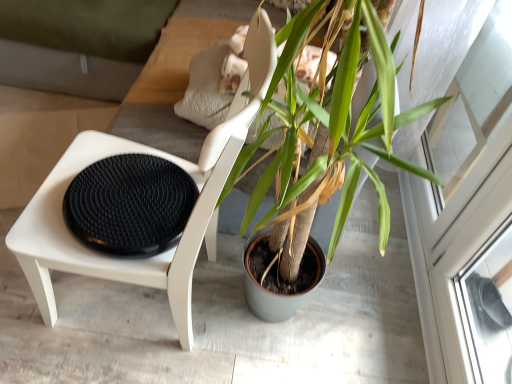
Question: Does green matte plant pot at center appear on the right side of black textured footrest at left?

Choices:
 (A) yes
 (B) no

Answer: (B)

Question: From the image's perspective, is green matte plant pot at center beneath black textured footrest at left?

Choices:
 (A) no
 (B) yes

Answer: (B)

Question: Is green matte plant pot at center positioned with its back to black textured footrest at left?

Choices:
 (A) yes
 (B) no

Answer: (B)

Question: Is green matte plant pot at center at the left side of black textured footrest at left?

Choices:
 (A) yes
 (B) no

Answer: (A)

Question: Does green matte plant pot at center have a lesser height compared to black textured footrest at left?

Choices:
 (A) no
 (B) yes

Answer: (B)

Question: Is green matte plant pot at center taller or shorter than transparent glass screen door at upper right?

Choices:
 (A) tall
 (B) short

Answer: (B)

Question: Would you say green matte plant pot at center is to the left or to the right of transparent glass screen door at upper right in the picture?

Choices:
 (A) left
 (B) right

Answer: (A)

Question: In the image, is green matte plant pot at center positioned in front of or behind transparent glass screen door at upper right?

Choices:
 (A) behind
 (B) front

Answer: (A)

Question: Is green matte plant pot at center spatially inside transparent glass screen door at upper right, or outside of it?

Choices:
 (A) inside
 (B) outside

Answer: (B)

Question: From the image's perspective, is transparent glass screen door at upper right positioned above or below white matte chair at left?

Choices:
 (A) above
 (B) below

Answer: (A)

Question: From a real-world perspective, relative to white matte chair at left, is transparent glass screen door at upper right vertically above or below?

Choices:
 (A) below
 (B) above

Answer: (A)

Question: From their relative heights in the image, would you say transparent glass screen door at upper right is taller or shorter than white matte chair at left?

Choices:
 (A) tall
 (B) short

Answer: (B)

Question: Considering their positions, is transparent glass screen door at upper right located in front of or behind white matte chair at left?

Choices:
 (A) front
 (B) behind

Answer: (B)

Question: Considering the positions of white matte chair at left and green matte plant pot at center in the image, is white matte chair at left taller or shorter than green matte plant pot at center?

Choices:
 (A) short
 (B) tall

Answer: (B)

Question: From a real-world perspective, is white matte chair at left physically located above or below green matte plant pot at center?

Choices:
 (A) below
 (B) above

Answer: (B)